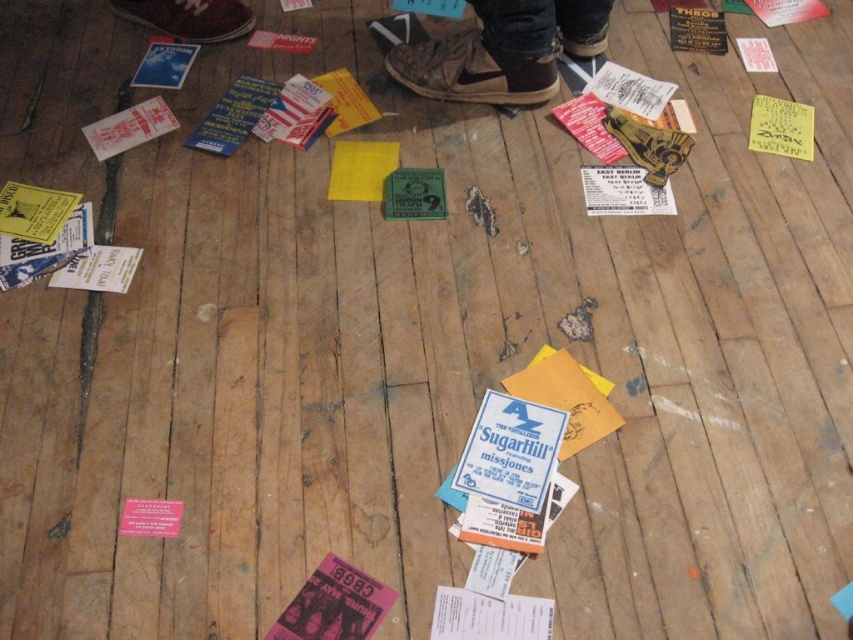
Question: Based on their relative distances, which object is farther from the white paper at left?

Choices:
 (A) white paper at upper left
 (B) yellow paper at upper right

Answer: (B)

Question: Among these points, which one is nearest to the camera?

Choices:
 (A) (543, 10)
 (B) (809, 141)

Answer: (A)

Question: Is brown suede shoes at upper center positioned before white paper at left?

Choices:
 (A) yes
 (B) no

Answer: (B)

Question: Can you confirm if white paper at upper left is wider than white paper at left?

Choices:
 (A) yes
 (B) no

Answer: (A)

Question: Is yellow paper at upper right above white paper at left?

Choices:
 (A) no
 (B) yes

Answer: (B)

Question: Which object is positioned farthest from the white paper at upper left?

Choices:
 (A) white paper at left
 (B) yellow paper at upper right

Answer: (B)